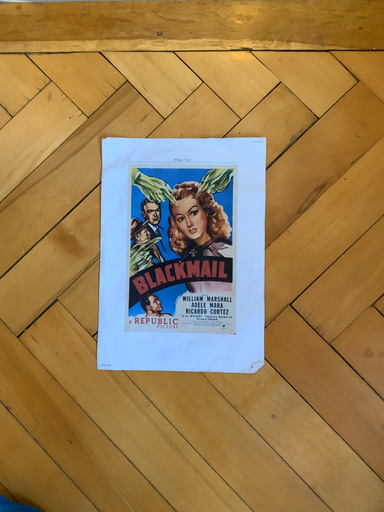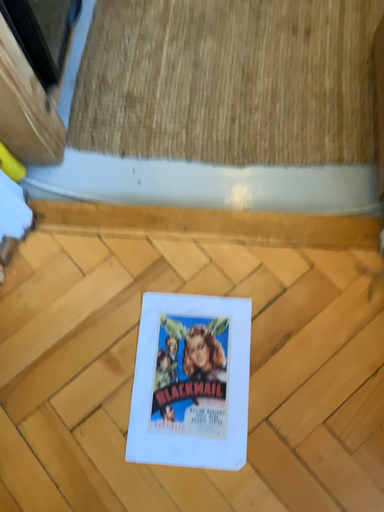
Question: How did the camera likely rotate when shooting the video?

Choices:
 (A) rotated upward
 (B) rotated downward

Answer: (A)